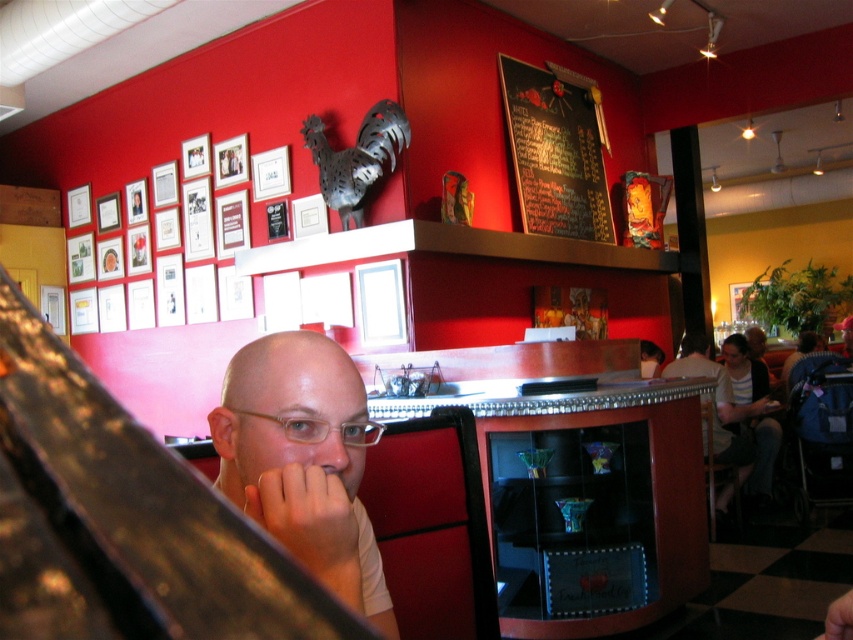
You are a customer in a restaurant and see the bar counter with a glass display case beneath it. You notice a point at coordinate (303, 460). What object is located at that point?

The point at coordinate (303, 460) corresponds to the matte white shirt at center.